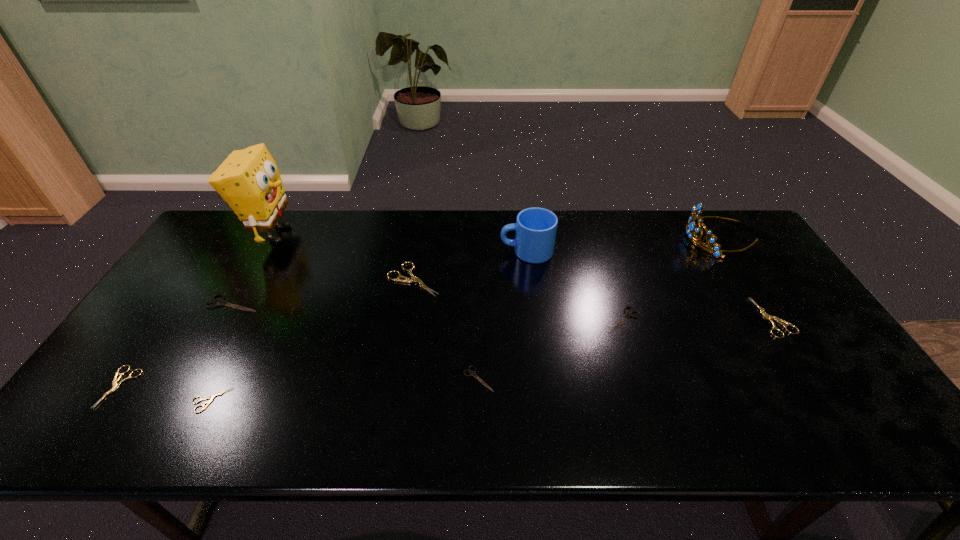
Image resolution: width=960 pixels, height=540 pixels. I want to click on sponge, so click(248, 180).

Image resolution: width=960 pixels, height=540 pixels. I want to click on yellow sponge, so click(248, 180).

Find the location of a particular element. tiara is located at coordinates (691, 226).

Locate an element on the screen. The width and height of the screenshot is (960, 540). the fourth object from right to left is located at coordinates (536, 228).

I want to click on the biggest black shears, so click(220, 302).

The height and width of the screenshot is (540, 960). Find the location of `the farthest beige shears`. the farthest beige shears is located at coordinates (414, 279).

I want to click on the second beige shears from right to left, so click(414, 279).

This screenshot has height=540, width=960. In order to click on the eighth object from left to right in this screenshot , I will do 628,314.

Identify the location of the second smallest black shears. The width and height of the screenshot is (960, 540). (628, 314).

Find the location of a particular element. The width and height of the screenshot is (960, 540). the rightmost beige shears is located at coordinates (770, 318).